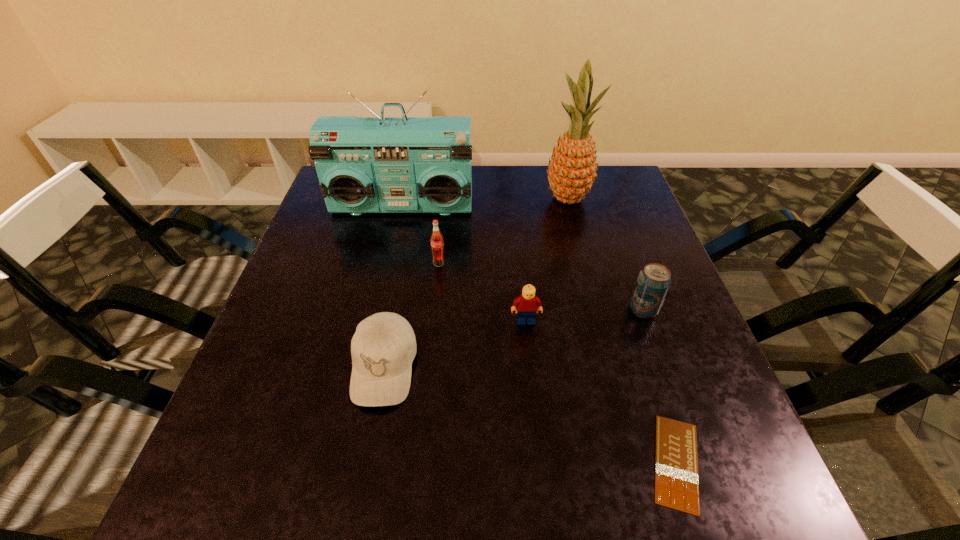
This screenshot has height=540, width=960. I want to click on pineapple, so click(572, 169).

Identify the location of radio receiver. Image resolution: width=960 pixels, height=540 pixels. (404, 164).

Find the location of a particular element. the third farthest object is located at coordinates (436, 238).

What are the coordinates of `the farther pop soda` in the screenshot? It's located at (x=436, y=238).

Locate an element on the screen. the nearer pop soda is located at coordinates (654, 280).

This screenshot has width=960, height=540. Identify the location of the fourth object from right to left. (528, 304).

Identify the location of the second nearest object. The image size is (960, 540). (383, 347).

Where is `the shortest object`? The image size is (960, 540). the shortest object is located at coordinates (676, 460).

You are a GUI agent. You are given a task and a screenshot of the screen. Output one action in this format:
    pyautogui.click(x=<x>, y=<y>)
    Task: Click on the nearest object
    This screenshot has height=540, width=960.
    Given the screenshot: What is the action you would take?
    pyautogui.click(x=676, y=460)

The height and width of the screenshot is (540, 960). Find the location of `vacant region located 0.350m on the left of the pineapple`. vacant region located 0.350m on the left of the pineapple is located at coordinates (420, 198).